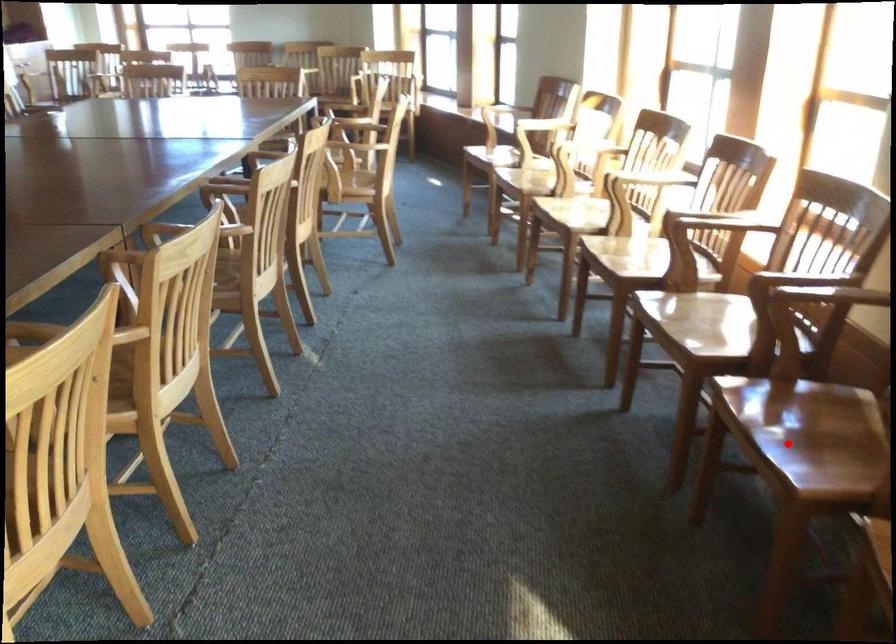
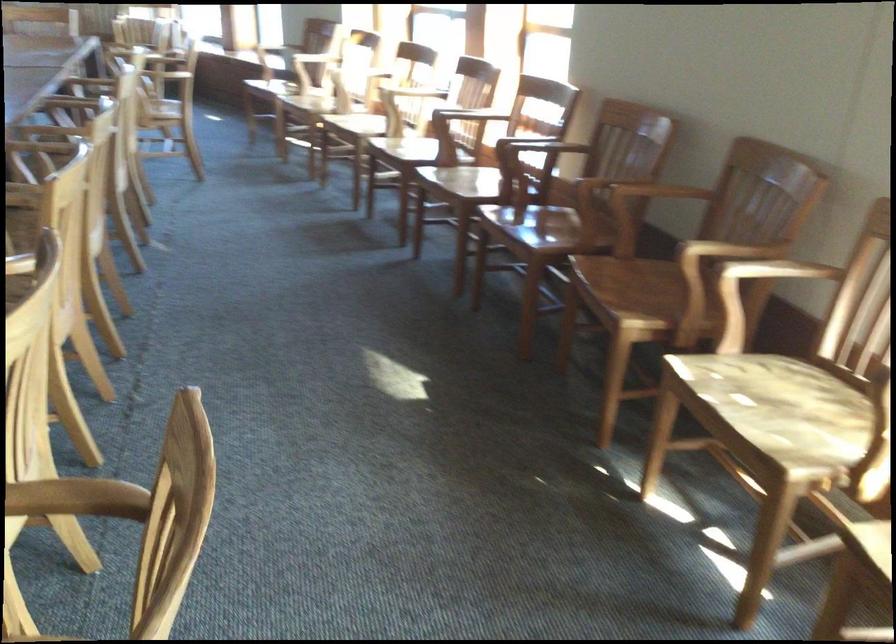
The point at the highlighted location is marked in the first image. Where is the corresponding point in the second image?

(531, 230)